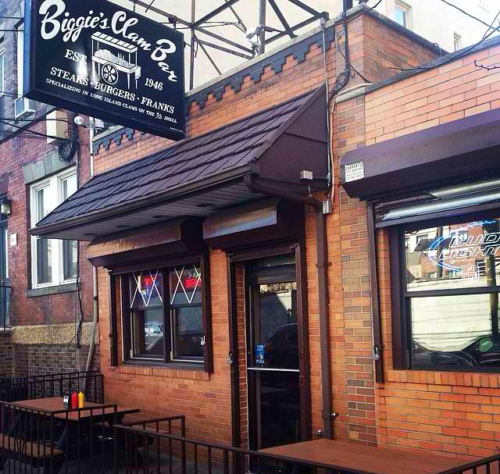
The image size is (500, 474). I want to click on tables, so click(368, 453), click(46, 396).